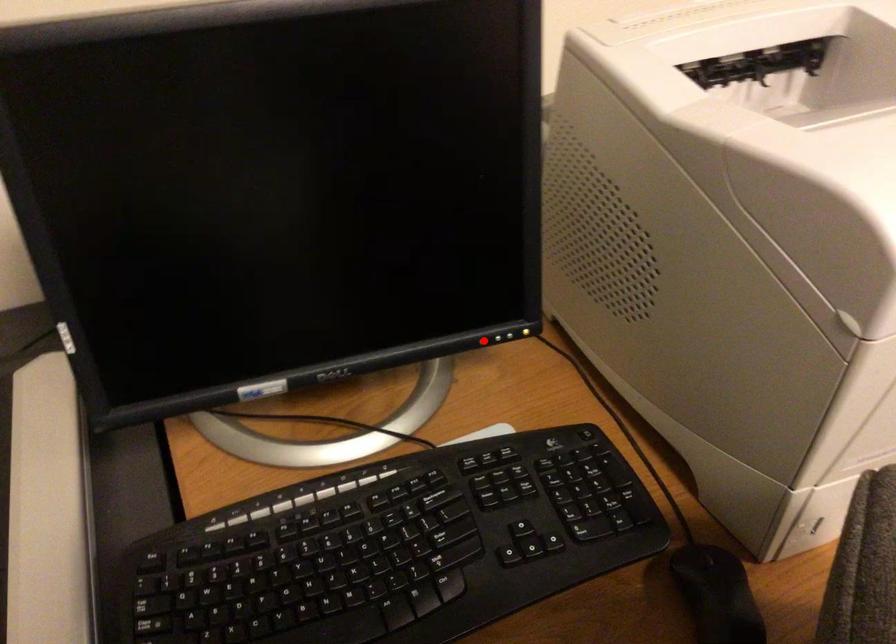
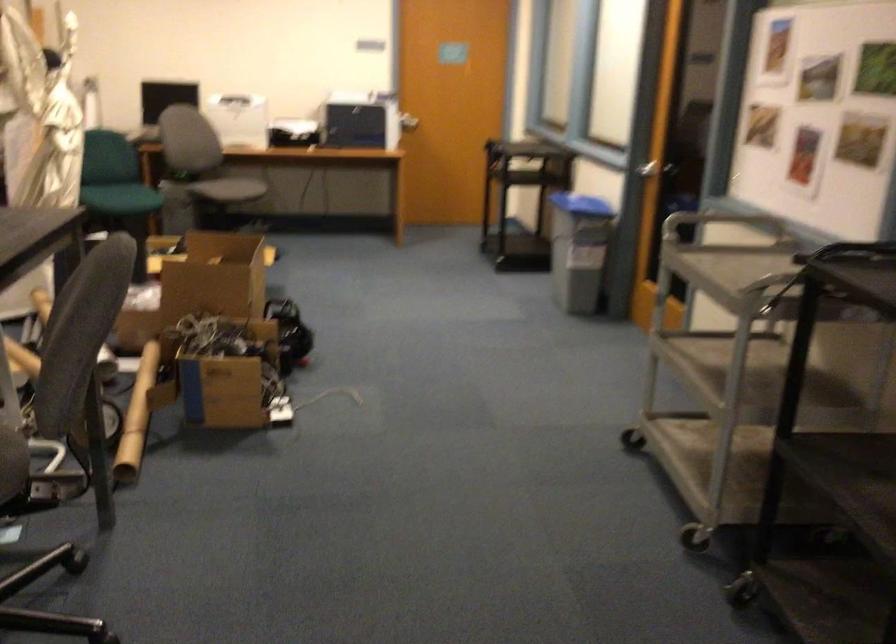
Question: I am providing you with two images of the same scene from different viewpoints. A red point is marked on the first image. At the location where the point appears in image 1, is it still visible in image 2?

Choices:
 (A) Yes
 (B) No

Answer: (B)